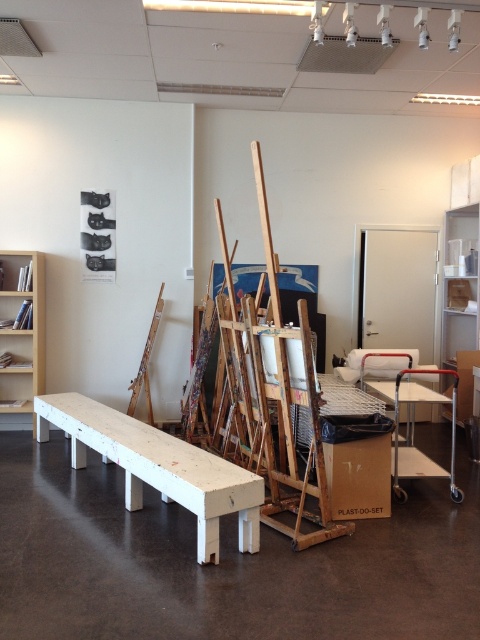
You are an artist who needs to sit down to rest. You see a white wood bench at center and a light brown wooden bookshelf at left. Which object can you sit on?

The white wood bench at center is bigger than the light brown wooden bookshelf at left, so you can sit on the white wood bench at center.